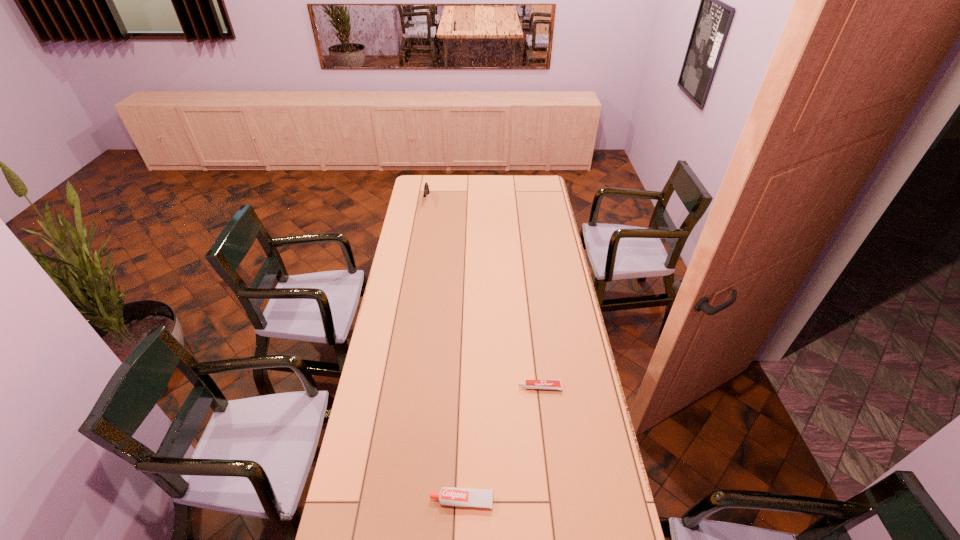
This screenshot has height=540, width=960. I want to click on vacant region between the farther toothpaste and the second tallest object, so click(501, 444).

Where is `free area in between the farther toothpaste and the farthest object`? free area in between the farther toothpaste and the farthest object is located at coordinates (484, 293).

Locate an element on the screen. This screenshot has width=960, height=540. vacant point located between the gun and the shorter toothpaste is located at coordinates (484, 293).

The image size is (960, 540). I want to click on vacant space that's between the left toothpaste and the shorter toothpaste, so click(501, 444).

Where is `vacant area that lies between the second shortest object and the leftmost object`? The width and height of the screenshot is (960, 540). vacant area that lies between the second shortest object and the leftmost object is located at coordinates (444, 350).

Locate an element on the screen. The height and width of the screenshot is (540, 960). vacant space that is in between the second shortest object and the shorter toothpaste is located at coordinates (501, 444).

You are a GUI agent. You are given a task and a screenshot of the screen. Output one action in this format:
    pyautogui.click(x=<x>, y=<y>)
    Task: Click on the vacant region between the shorter toothpaste and the left toothpaste
    This screenshot has height=540, width=960.
    Given the screenshot: What is the action you would take?
    pyautogui.click(x=501, y=444)

Locate an element on the screen. This screenshot has width=960, height=540. free spot between the left toothpaste and the leftmost object is located at coordinates (444, 350).

Find the location of a particular element. unoccupied position between the gun and the second tallest object is located at coordinates (444, 350).

Find the location of a particular element. This screenshot has height=540, width=960. vacant space in between the nearest object and the farthest object is located at coordinates (444, 350).